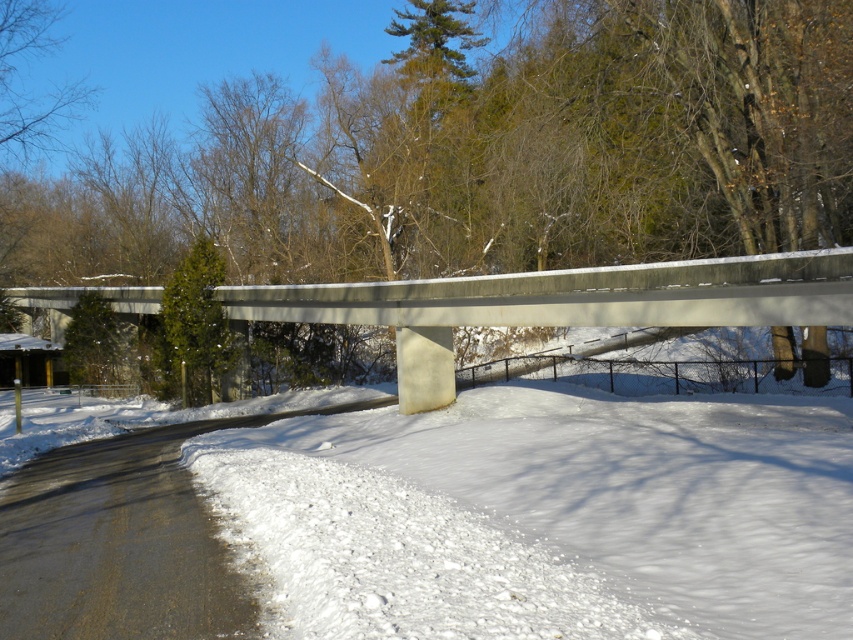
Question: Which point is farther to the camera?

Choices:
 (A) (x=404, y=429)
 (B) (x=335, y=291)

Answer: (B)

Question: Does white powdery snow at lower center have a greater width compared to concrete at upper center?

Choices:
 (A) no
 (B) yes

Answer: (A)

Question: Is white powdery snow at lower center below concrete at upper center?

Choices:
 (A) no
 (B) yes

Answer: (B)

Question: Which object appears farthest from the camera in this image?

Choices:
 (A) white powdery snow at lower center
 (B) concrete at upper center

Answer: (B)

Question: Which object is closer to the camera taking this photo?

Choices:
 (A) white powdery snow at lower center
 (B) concrete at upper center

Answer: (A)

Question: Does white powdery snow at lower center have a larger size compared to concrete at upper center?

Choices:
 (A) yes
 (B) no

Answer: (B)